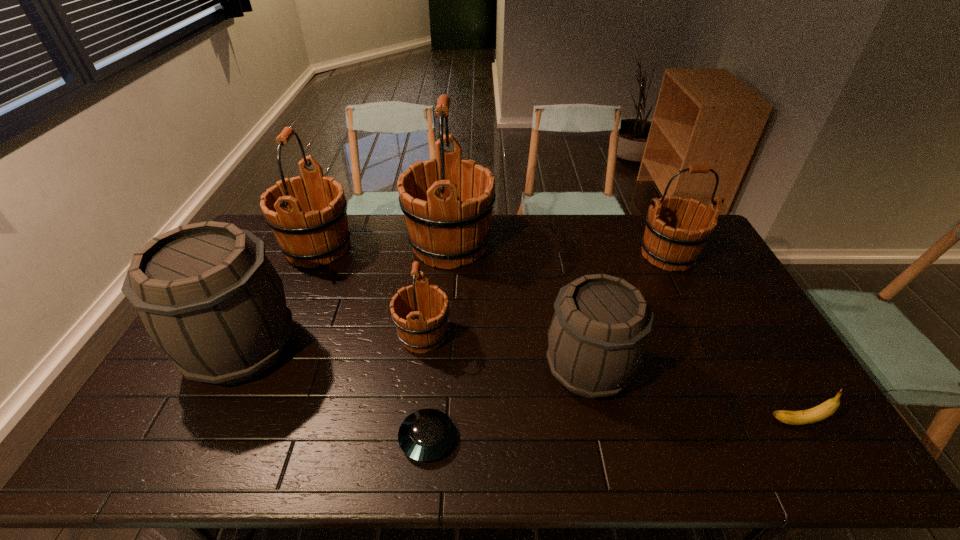
Where is `the biggest wood wine bucket`? the biggest wood wine bucket is located at coordinates (447, 202).

Find the location of a particular element. The image size is (960, 540). the tallest object is located at coordinates (447, 202).

You are a GUI agent. You are given a task and a screenshot of the screen. Output one action in this format:
    pyautogui.click(x=<x>, y=<y>)
    Task: Click on the fifth shortest wine bucket
    
    Given the screenshot: What is the action you would take?
    pyautogui.click(x=305, y=237)

The width and height of the screenshot is (960, 540). I want to click on the leftmost wood wine bucket, so click(305, 237).

Locate an element on the screen. The image size is (960, 540). the rightmost wine bucket is located at coordinates (667, 242).

Where is `the third biggest wood wine bucket`? This screenshot has width=960, height=540. the third biggest wood wine bucket is located at coordinates (667, 242).

This screenshot has width=960, height=540. I want to click on the left brown wine bucket, so click(x=206, y=293).

Identify the location of the smallest wood wine bucket. The width and height of the screenshot is (960, 540). (420, 330).

Locate an element on the screen. The image size is (960, 540). the right brown wine bucket is located at coordinates (596, 339).

Find the location of a particular element. the fifth wine bucket from left to right is located at coordinates (596, 339).